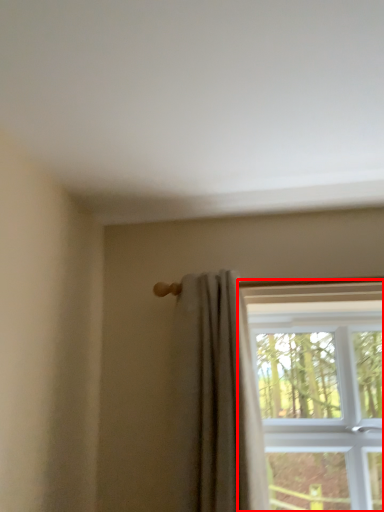
Question: Where is window (annotated by the red box) located in relation to curtain in the image?

Choices:
 (A) right
 (B) left

Answer: (A)